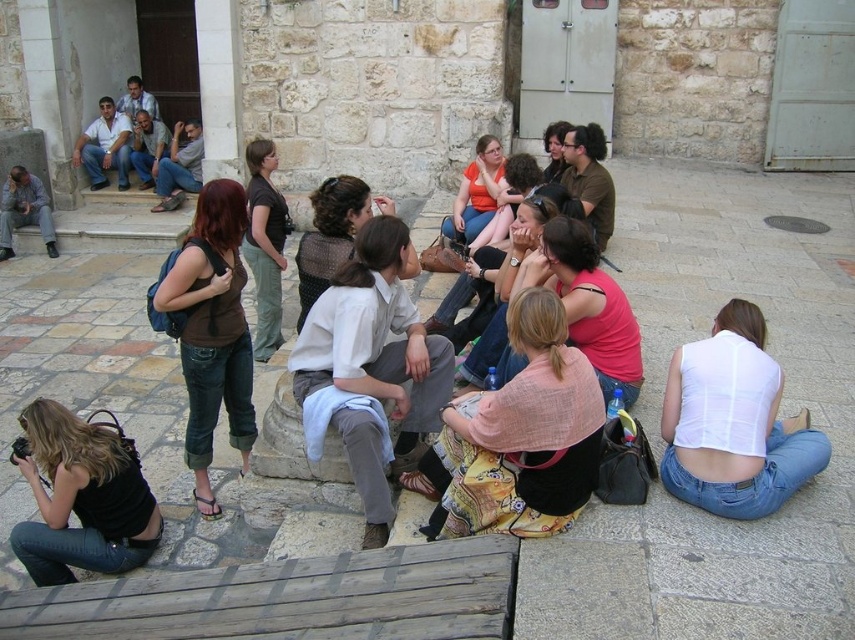
You are a photographer trying to capture a photo of the matte orange shirt at center and the white sheer top at lower right. Since you want both subjects in the frame, which direction should you move to ensure both are visible?

The white sheer top at lower right is to the right of the matte orange shirt at center. To include both in the frame, move to the left so that you can capture the matte orange shirt at center on the right side of the frame and the white sheer top at lower right on the left side.

You are a photographer setting up a shot of the light brown fabric shirt at center and the black denim jeans at lower left. You want to ensure both subjects are in focus. Since the camera can only focus on one subject at a time, which subject should you prioritize focusing on to maximize the chances of both being in focus?

You should focus on the light brown fabric shirt at center because it is wider than the black denim jeans at lower left, so focusing on the wider subject increases the depth of field and improves the likelihood of both being in focus.

You are standing at the point labeled point [258,269] and want to walk to the point labeled point [56,554]. Which direction should you head?

You should head forward because point [56,554] is in front of point [258,269].